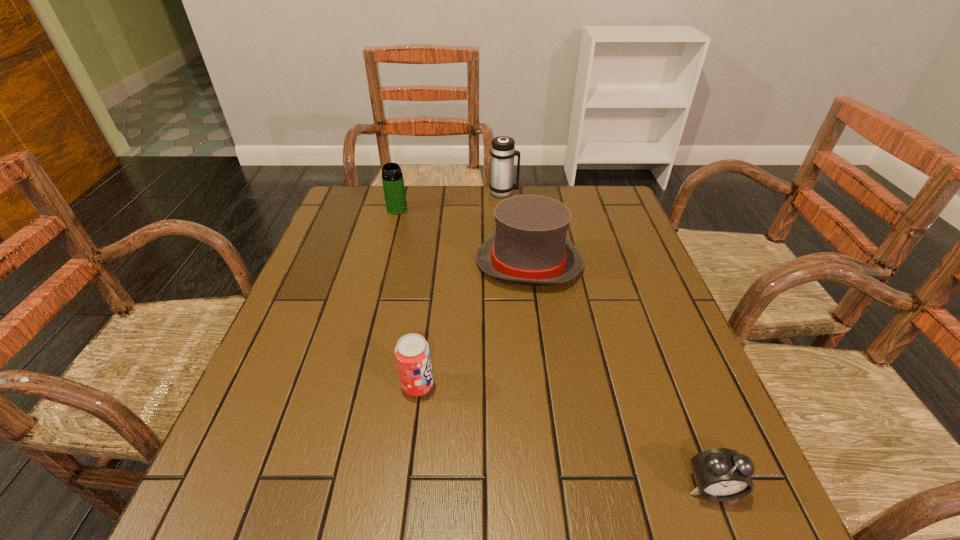
This screenshot has height=540, width=960. Identify the location of vacant space that satisfies the following two spatial constraints: 1. on the back side of the third farthest object; 2. on the side with the handle of the right thermos bottle. (519, 193).

The image size is (960, 540). Identify the location of vacant region that satisfies the following two spatial constraints: 1. on the side with the handle of the right thermos bottle; 2. on the right side of the third nearest object. (509, 264).